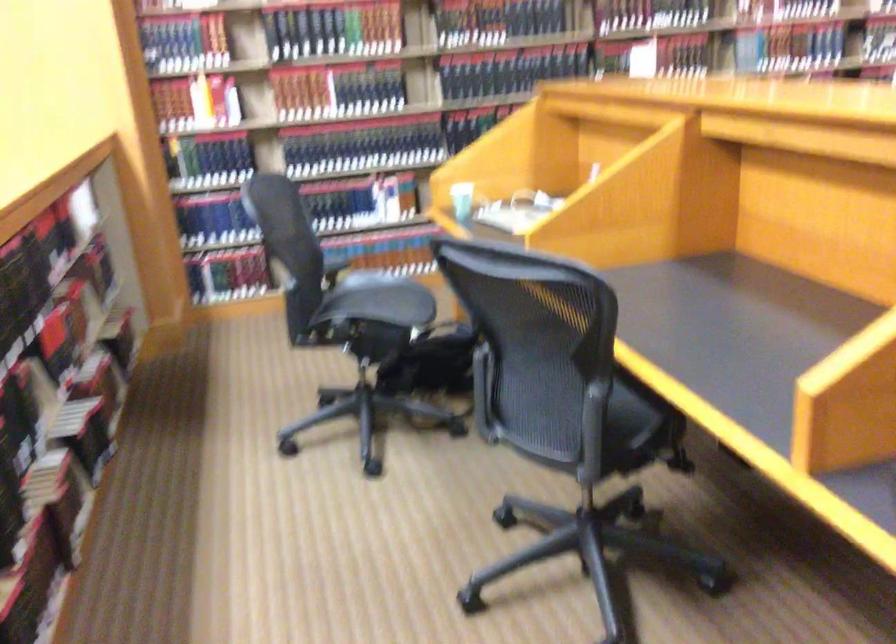
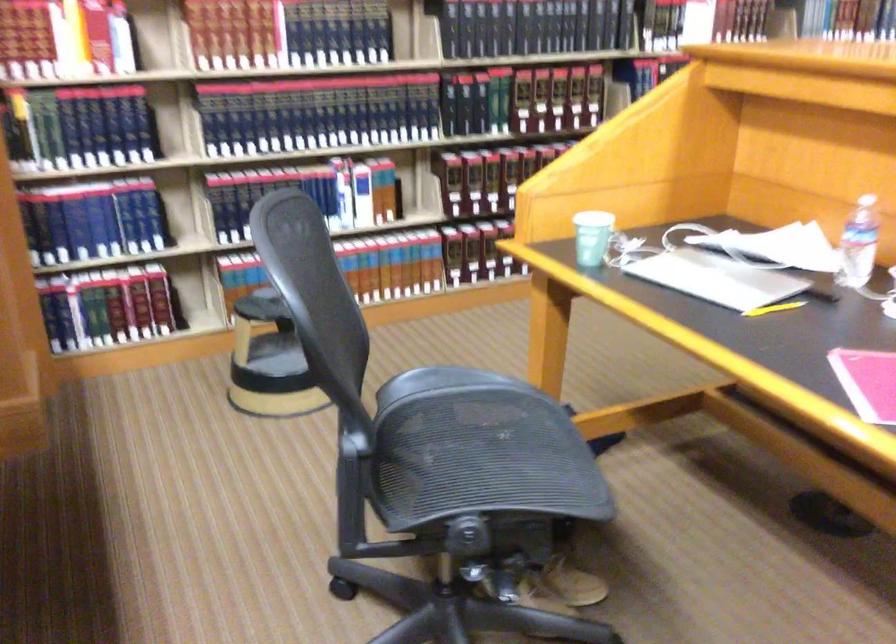
Which direction would the cameraman need to move to produce the second image?

The cameraman walked toward left, forward.